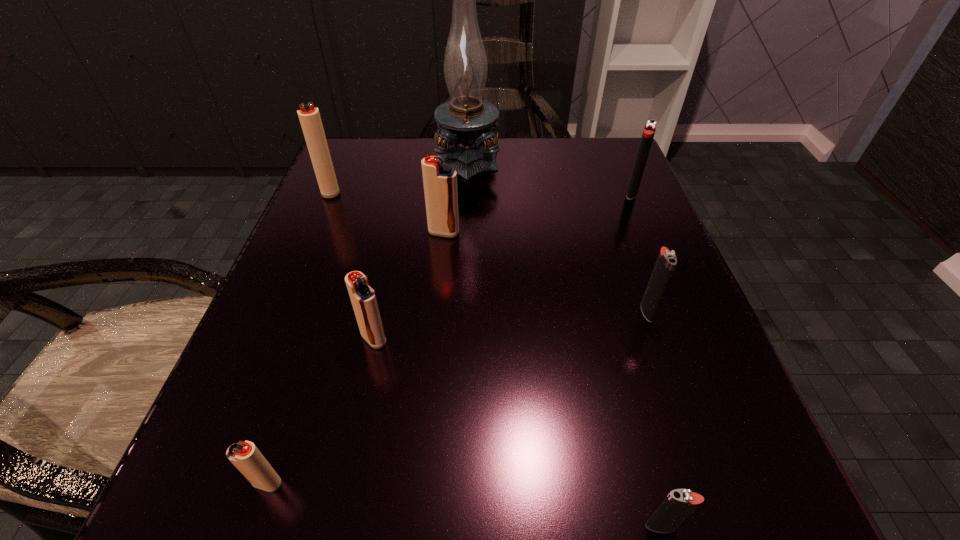
At what (x,y) coordinates should I click in order to perform the action: click on free region at the near edge of the desktop. Please return your answer as a coordinate pair (x, y). Image resolution: width=960 pixels, height=540 pixels. Looking at the image, I should click on (563, 505).

Find the location of `vacant space at the left edge of the desktop`. vacant space at the left edge of the desktop is located at coordinates (348, 327).

Find the location of a particular element. Image resolution: width=960 pixels, height=540 pixels. vacant space at the right edge of the desktop is located at coordinates (595, 221).

Where is `free region at the far left corner of the desktop`? free region at the far left corner of the desktop is located at coordinates (345, 185).

In the image, there is a desktop. At what (x,y) coordinates should I click in order to perform the action: click on free space at the near left corner. Please return your answer as a coordinate pair (x, y). The width and height of the screenshot is (960, 540). Looking at the image, I should click on (235, 529).

Locate an element on the screen. free region at the far right corner of the desktop is located at coordinates (607, 153).

Find the location of a particular element. The image size is (960, 540). vacant area that lies between the biggest black igniter and the smallest black igniter is located at coordinates (646, 360).

Identify the location of free space between the third object from right to left and the tallest object. The height and width of the screenshot is (540, 960). (564, 342).

Find the location of a particular element. This screenshot has width=960, height=540. vacant area that lies between the farthest black igniter and the smallest red igniter is located at coordinates (449, 338).

Identify the location of free point between the second object from left to right and the fourth igniter from left to right. The width and height of the screenshot is (960, 540). (355, 357).